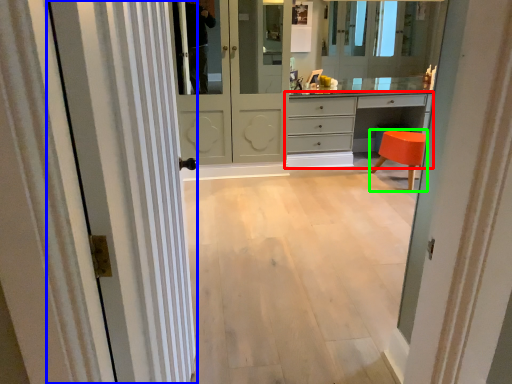
Question: Considering the real-world distances, which object is closest to chest of drawers (highlighted by a red box)? door (highlighted by a blue box) or stool (highlighted by a green box).

Choices:
 (A) door
 (B) stool

Answer: (B)